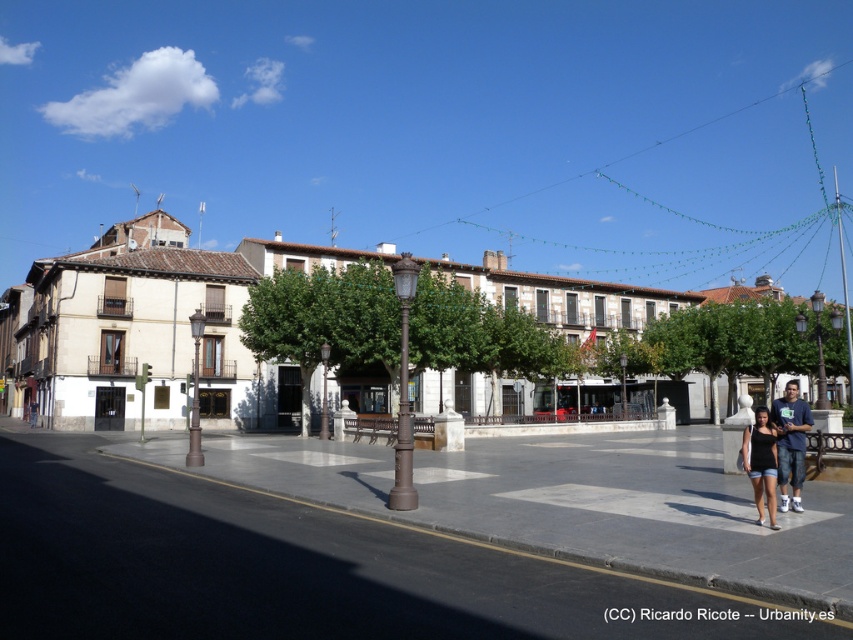
Question: Which point is farther to the camera?

Choices:
 (A) gray concrete pavement at center
 (B) matte black shorts at lower right
 (C) white stone building at center

Answer: (C)

Question: Which object appears closest to the camera in this image?

Choices:
 (A) matte black t-shirt at lower right
 (B) white stone building at center

Answer: (A)

Question: Does matte black t-shirt at lower right appear on the right side of matte black shorts at lower right?

Choices:
 (A) no
 (B) yes

Answer: (B)

Question: Which of the following is the closest to the observer?

Choices:
 (A) matte black shorts at lower right
 (B) matte black t-shirt at lower right
 (C) white stone building at center
 (D) gray concrete pavement at center

Answer: (D)

Question: Is white stone building at center to the right of matte black shorts at lower right from the viewer's perspective?

Choices:
 (A) yes
 (B) no

Answer: (B)

Question: Where is gray concrete pavement at center located in relation to white stone building at center in the image?

Choices:
 (A) above
 (B) below

Answer: (B)